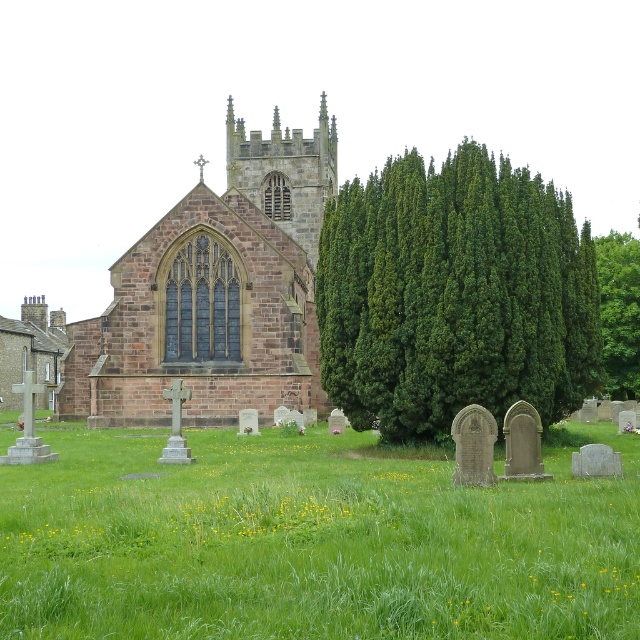
You are standing in the churchyard and want to take a photo of the brown stone church at center. You notice the green coniferous tree at center is blocking part of the church. Is the tree taller than the church?

The green coniferous tree at center has a lesser height compared to the brown stone church at center, so the tree is shorter than the church. Therefore, the tree is not taller than the church and is likely not blocking the entire church in your photo.

In the scene shown: You are a gardener standing at the green coniferous tree at center. You need to water the brown stone church at center. Can you reach it with a standard garden hose that has a maximum extension of 25 meters?

The distance between the green coniferous tree at center and the brown stone church at center is 27.36 meters, which exceeds the garden hose maximum extension of 25 meters. You cannot reach the brown stone church at center with the hose.

You are standing in the churchyard and want to take a photo that includes both the brown stone church at center and the green leafy tree at upper right. Given that your camera has a maximum zoom range of 50 meters, will you be able to capture both subjects in a single frame without moving closer?

The brown stone church at center and the green leafy tree at upper right are 47.07 meters apart from each other. Since the distance between them is within the camera maximum zoom range of 50 meters, you can capture both subjects in a single frame without moving closer.